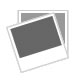
This screenshot has width=80, height=80. I want to click on corner, so click(x=6, y=27), click(x=10, y=29), click(x=60, y=44), click(x=67, y=57).